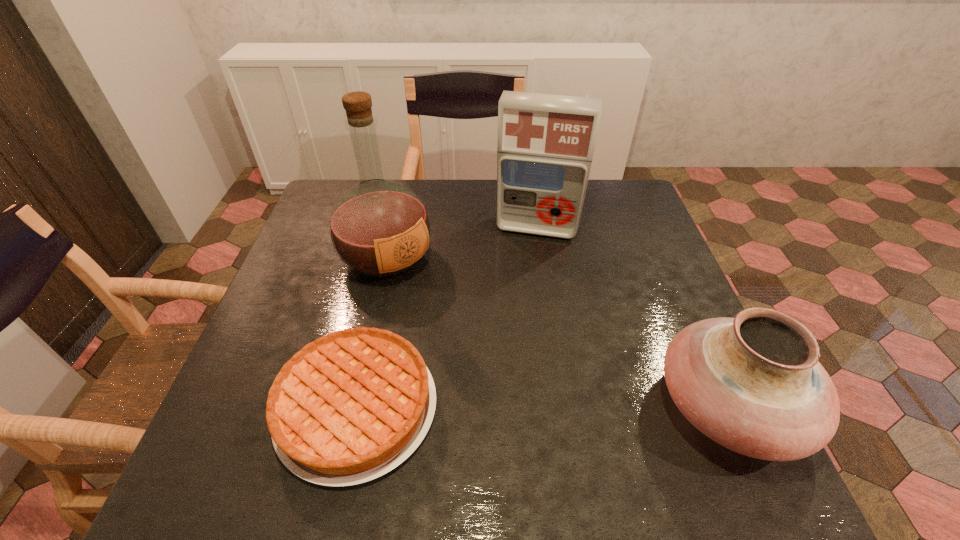
Where is `object that is the nearest to the second shortest object`? object that is the nearest to the second shortest object is located at coordinates (545, 145).

This screenshot has height=540, width=960. Find the location of `vacant space that satisfies the following two spatial constraints: 1. on the back side of the second tallest object; 2. on the right side of the shortest object`. vacant space that satisfies the following two spatial constraints: 1. on the back side of the second tallest object; 2. on the right side of the shortest object is located at coordinates (396, 228).